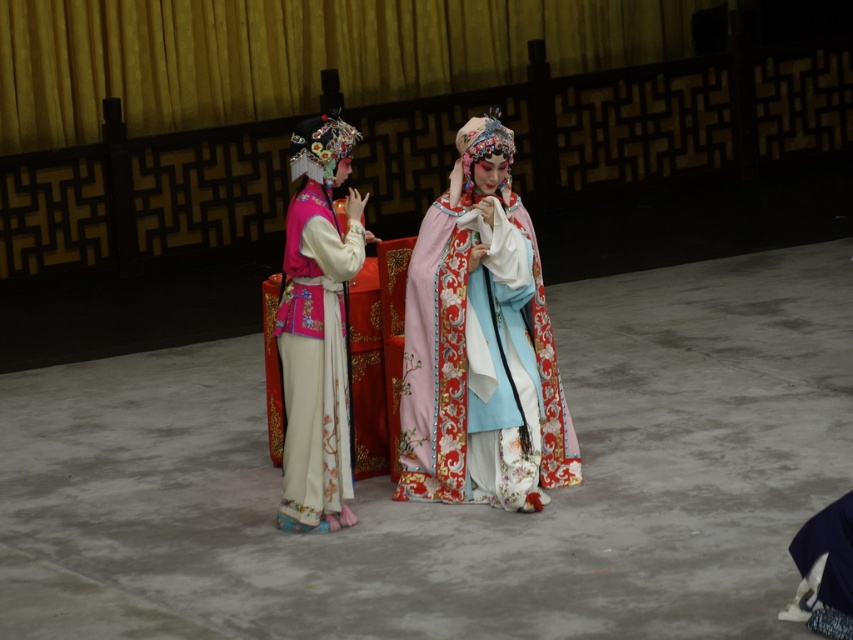
Is silky brocade robe at center below matte pink silk robe at left?

Incorrect, silky brocade robe at center is not positioned below matte pink silk robe at left.

Is silky brocade robe at center to the left of matte pink silk robe at left from the viewer's perspective?

In fact, silky brocade robe at center is to the right of matte pink silk robe at left.

You are a GUI agent. You are given a task and a screenshot of the screen. Output one action in this format:
    pyautogui.click(x=<x>, y=<y>)
    Task: Click on the silky brocade robe at center
    The width and height of the screenshot is (853, 640).
    Given the screenshot: What is the action you would take?
    pyautogui.click(x=480, y=344)

Identify the location of silky brocade robe at center. (480, 344).